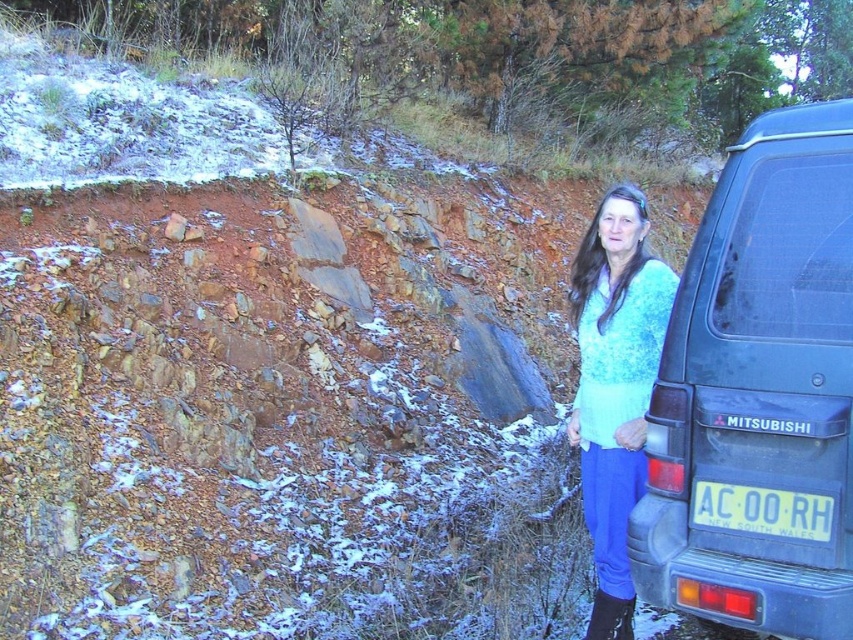
Question: Which object is the closest to the light blue knitted sweater at center?

Choices:
 (A) yellow plastic license plate at lower right
 (B) matte blue suv at right

Answer: (B)

Question: In this image, where is light blue knitted sweater at center located relative to yellow plastic license plate at lower right?

Choices:
 (A) below
 (B) above

Answer: (B)

Question: Is the position of matte blue suv at right less distant than that of yellow plastic license plate at lower right?

Choices:
 (A) yes
 (B) no

Answer: (A)

Question: From the image, what is the correct spatial relationship of light blue knitted sweater at center in relation to yellow plastic license plate at lower right?

Choices:
 (A) above
 (B) below

Answer: (A)

Question: Considering the real-world distances, which object is farthest from the light blue knitted sweater at center?

Choices:
 (A) matte blue suv at right
 (B) yellow plastic license plate at lower right

Answer: (B)

Question: Which object is farther from the camera taking this photo?

Choices:
 (A) light blue knitted sweater at center
 (B) matte blue suv at right
 (C) yellow plastic license plate at lower right

Answer: (A)